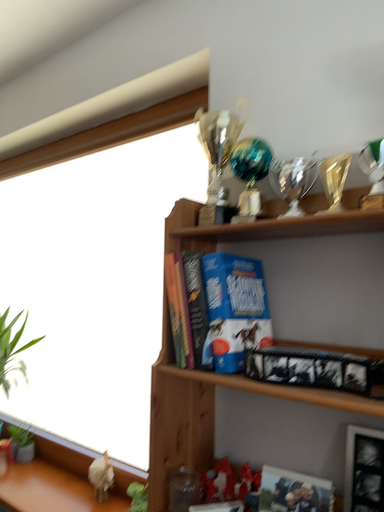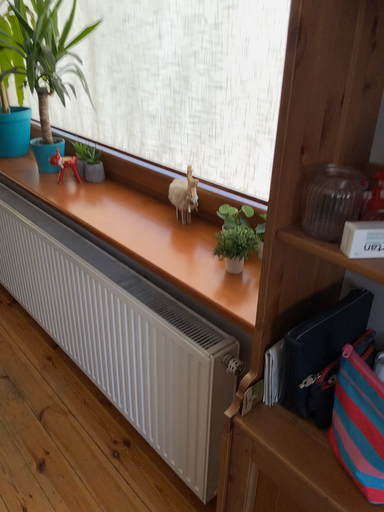
Question: Which way did the camera rotate in the video?

Choices:
 (A) rotated right
 (B) rotated left

Answer: (B)